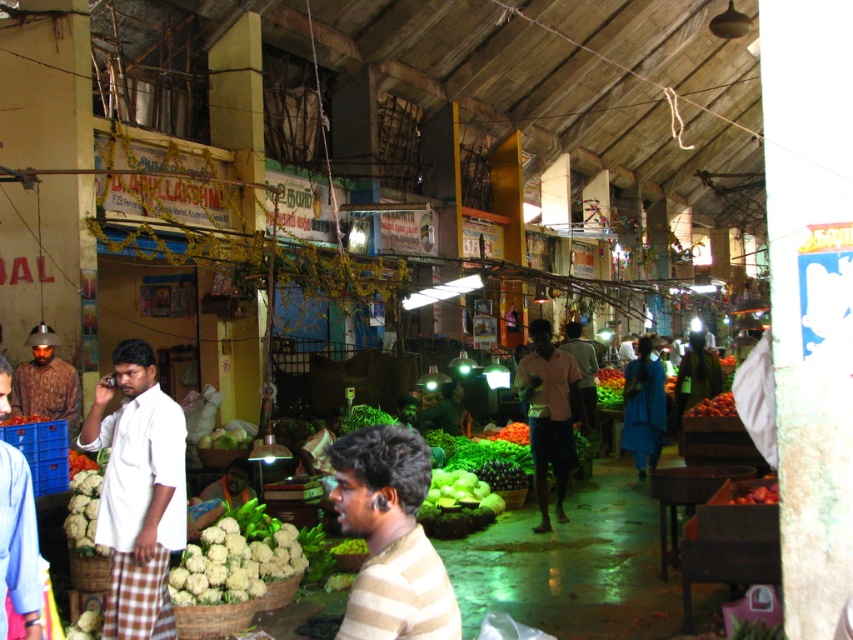
Question: Considering the relative positions of green matte cauliflower at lower left and shiny red tomatoes at center in the image provided, where is green matte cauliflower at lower left located with respect to shiny red tomatoes at center?

Choices:
 (A) above
 (B) below

Answer: (B)

Question: Is white shirt at left bigger than matte brown helmet at left?

Choices:
 (A) yes
 (B) no

Answer: (B)

Question: Considering the relative positions of striped cotton shirt at center and shiny red tomatoes at center in the image provided, where is striped cotton shirt at center located with respect to shiny red tomatoes at center?

Choices:
 (A) right
 (B) left

Answer: (B)

Question: Which point is farther to the camera?

Choices:
 (A) (234, 433)
 (B) (9, 536)
 (C) (740, 502)

Answer: (A)

Question: Which of the following is the closest to the observer?

Choices:
 (A) (62, 396)
 (B) (4, 609)

Answer: (B)

Question: Estimate the real-world distances between objects in this image. Which object is closer to the shiny red tomatoes at center?

Choices:
 (A) matte brown helmet at left
 (B) white cauliflower at lower center
 (C) white shirt at left

Answer: (B)